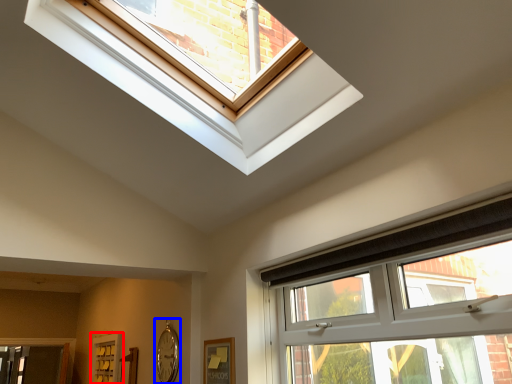
Question: Which object is closer to the camera taking this photo, screen door (highlighted by a red box) or clock (highlighted by a blue box)?

Choices:
 (A) screen door
 (B) clock

Answer: (B)